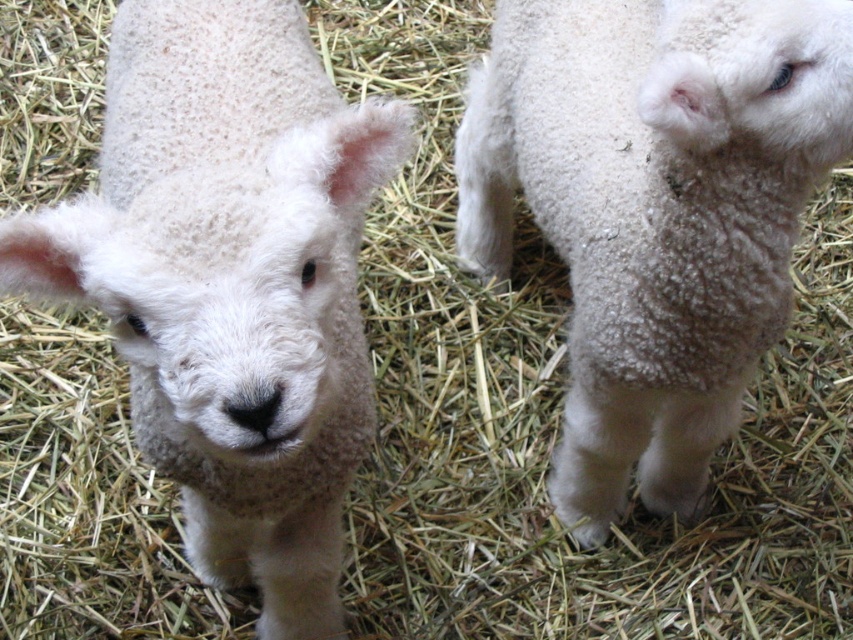
Question: Is white woolen lamb at center to the left of white fluffy lamb at center from the viewer's perspective?

Choices:
 (A) no
 (B) yes

Answer: (B)

Question: Among these points, which one is farthest from the camera?

Choices:
 (A) (235, 161)
 (B) (648, 250)

Answer: (B)

Question: Which of the following is the farthest from the observer?

Choices:
 (A) white woolen lamb at center
 (B) white fluffy lamb at center

Answer: (B)

Question: Which point is farther to the camera?

Choices:
 (A) white fluffy lamb at center
 (B) white woolen lamb at center

Answer: (A)

Question: Is white woolen lamb at center smaller than white fluffy lamb at center?

Choices:
 (A) no
 (B) yes

Answer: (B)

Question: Does white woolen lamb at center appear on the left side of white fluffy lamb at center?

Choices:
 (A) yes
 (B) no

Answer: (A)